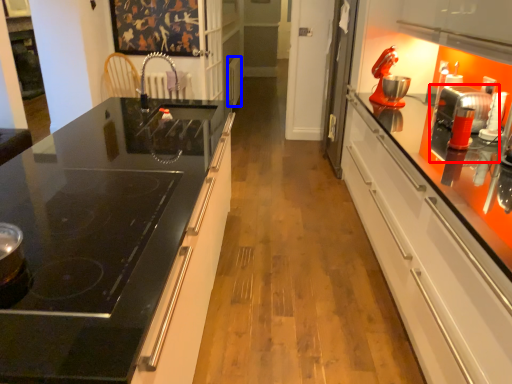
Question: Which of the following is the farthest to the observer, appliance (highlighted by a red box) or appliance (highlighted by a blue box)?

Choices:
 (A) appliance
 (B) appliance

Answer: (B)